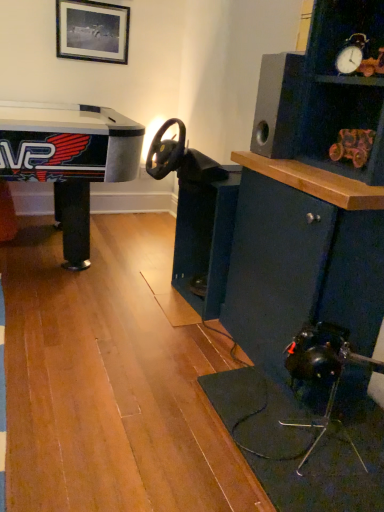
Locate an element on the screen. The image size is (384, 512). free space that is to the left of dark blue wood cabinet at center is located at coordinates (144, 303).